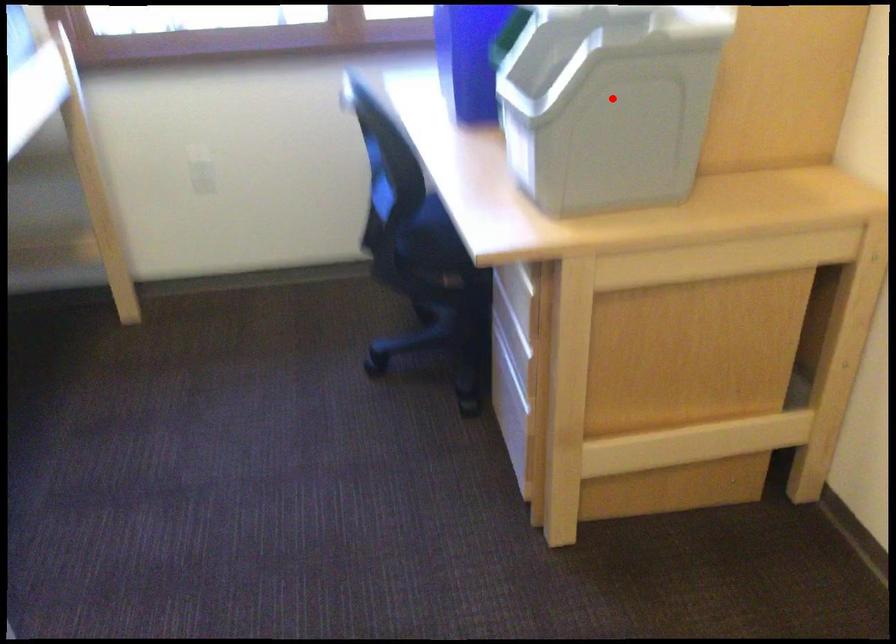
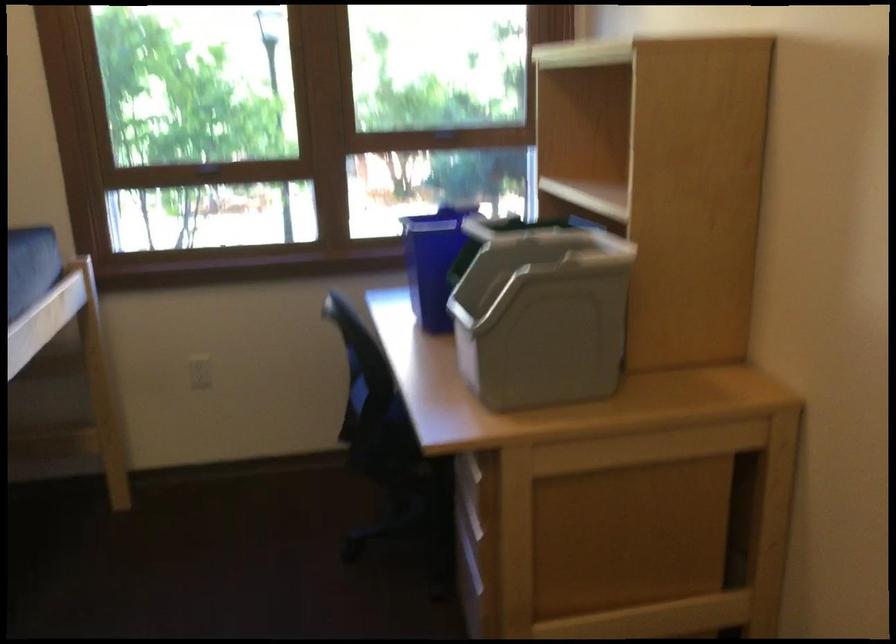
Question: I am providing you with two images of the same scene from different viewpoints. A red point is marked on the first image. Can you still see the location of the red point in image 2?

Choices:
 (A) Yes
 (B) No

Answer: (A)